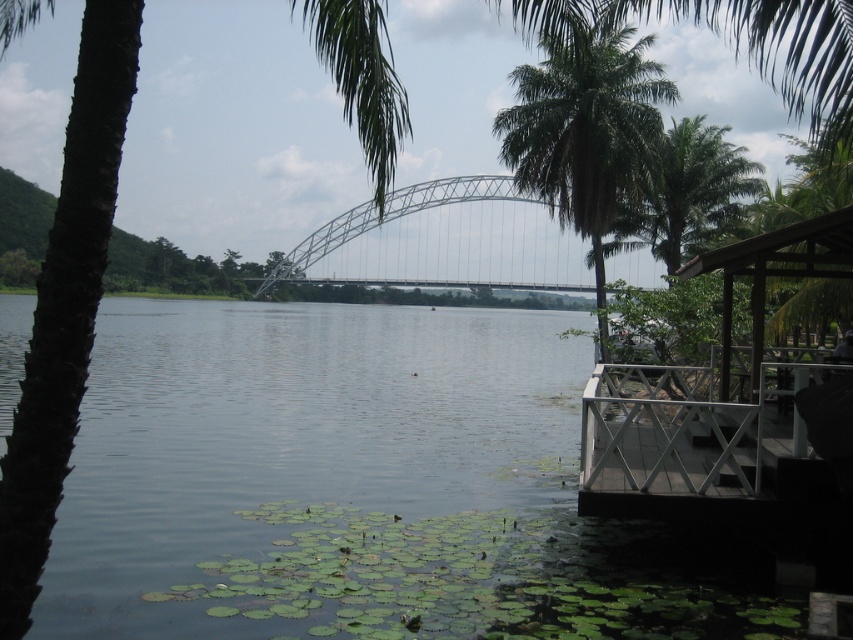
You are a photographer planning to capture the entire view of the metallic gray bridge at center and the green leafy palm tree at upper right in a single shot. Based on their sizes, which object will occupy more space in the photo?

The metallic gray bridge at center will occupy more space in the photo since its width surpasses that of the green leafy palm tree at upper right.

You are a painter setting up your easel to capture the riverside scene. You want to focus on the white metal dock at lower right and the metallic gray bridge at center. Which of these two objects should you place closer to the foreground in your painting to maintain the scene proportions?

The white metal dock at lower right is smaller than the metallic gray bridge at center. To maintain the scene proportions, you should place the white metal dock at lower right closer to the foreground since smaller objects are typically positioned closer to the viewer in paintings for proper perspective.